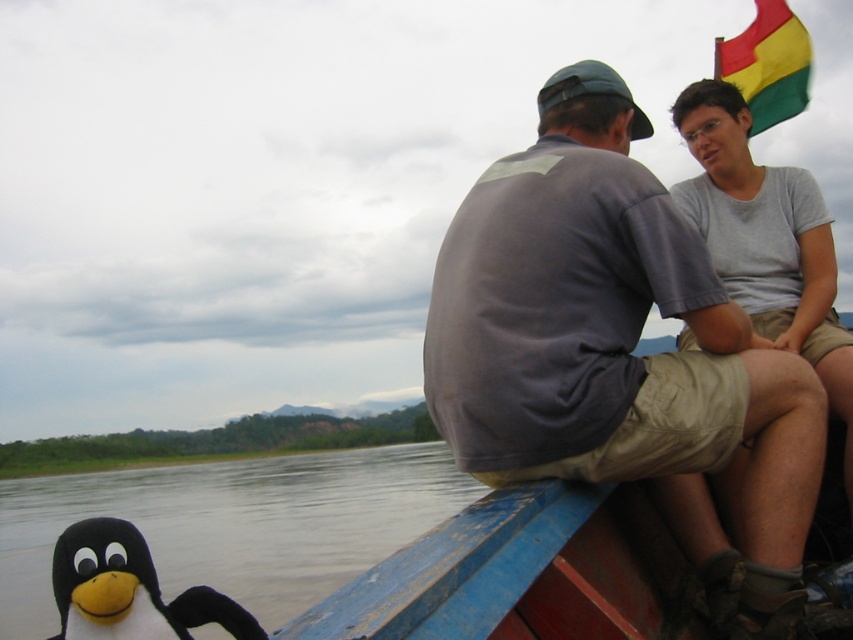
In the scene shown: Who is more distant from viewer, (641, 433) or (740, 83)?

Point (740, 83)

Can you confirm if gray cotton shirt at upper right is positioned to the left of yellow-green fabric flag at upper right?

Yes, gray cotton shirt at upper right is to the left of yellow-green fabric flag at upper right.

Is point (799, 536) closer to camera compared to point (769, 19)?

That is True.

Identify the location of gray cotton shirt at upper right. Image resolution: width=853 pixels, height=640 pixels. (x=621, y=355).

Who is positioned more to the left, white matte water at lower left or yellow-green fabric flag at upper right?

white matte water at lower left is more to the left.

Does point (99, 483) lie in front of point (780, 22)?

No.

Where is `white matte water at lower left`? The width and height of the screenshot is (853, 640). white matte water at lower left is located at coordinates (234, 524).

Is point (743, 342) less distant than point (113, 576)?

That is False.

Is gray cotton shirt at upper right to the right of black plush penguin at lower left from the viewer's perspective?

Yes, gray cotton shirt at upper right is to the right of black plush penguin at lower left.

Is point (669, 436) closer to viewer compared to point (144, 552)?

That is False.

The image size is (853, 640). Find the location of `gray cotton shirt at upper right`. gray cotton shirt at upper right is located at coordinates (621, 355).